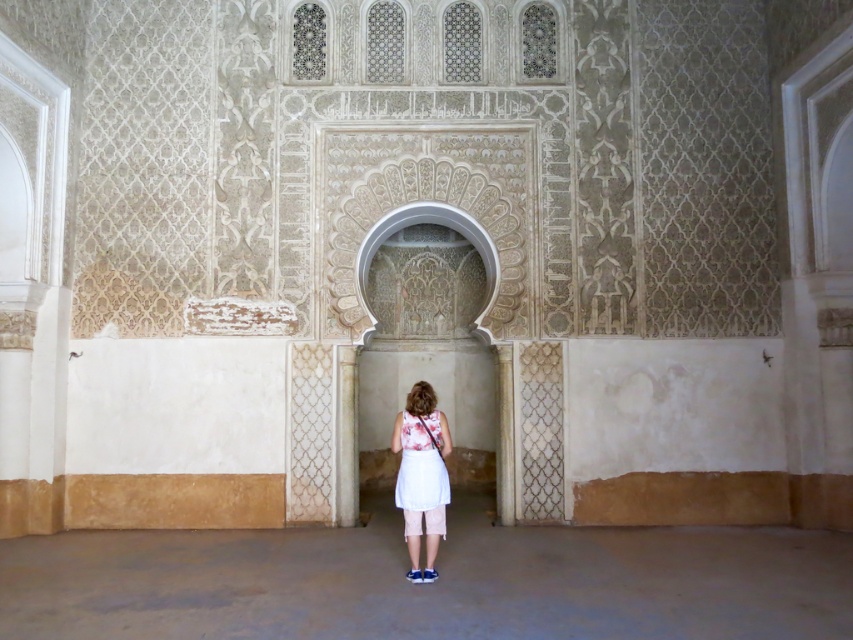
You are standing in the historical building and want to pass through the space between the white cotton dress at center and the white textured pillar at lower center. Can you walk through the space between them comfortably?

The white cotton dress at center might be wider than the white textured pillar at lower center, so the space between them may be narrow. It is uncertain if you can walk through comfortably without more information about their exact widths.

You are an architect designing a replica of this space. You need to ensure that the carved stone archway at center and the white textured pillar at lower center are proportionate. Which object should you consider adjusting in width to maintain the correct proportions?

The carved stone archway at center might be wider than white textured pillar at lower center, so to maintain proportions, adjust the white textured pillar at lower center to match the width of the archway.

You are an interior designer planning to place a white cotton dress at center in front of the carved stone archway at center. Given their widths, which object will appear wider from the viewer?

The carved stone archway at center is wider than the white cotton dress at center, so the carved stone archway at center will appear wider from the viewer.